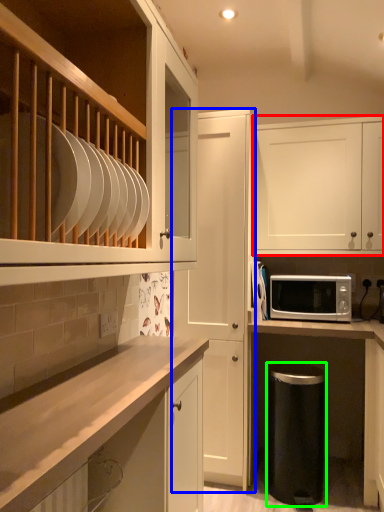
Question: Which is farther away from cabinetry (highlighted by a red box)? cabinetry (highlighted by a blue box) or dish washer (highlighted by a green box)?

Choices:
 (A) cabinetry
 (B) dish washer

Answer: (B)